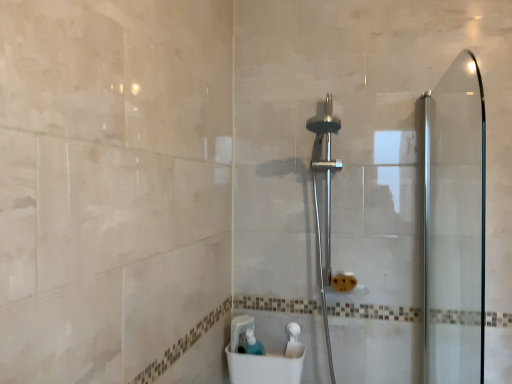
Question: Considering their positions, is polished chrome shower head at center located in front of or behind translucent plastic soap dispenser at lower center?

Choices:
 (A) behind
 (B) front

Answer: (B)

Question: Do you think polished chrome shower head at center is within translucent plastic soap dispenser at lower center, or outside of it?

Choices:
 (A) outside
 (B) inside

Answer: (A)

Question: Estimate the real-world distances between objects in this image. Which object is closer to the transparent glass screen door at right?

Choices:
 (A) white plastic sink at lower center
 (B) translucent plastic soap dispenser at lower center
 (C) polished chrome shower head at center

Answer: (C)

Question: Which object is the closest to the translucent plastic soap dispenser at lower center?

Choices:
 (A) transparent glass screen door at right
 (B) white plastic sink at lower center
 (C) polished chrome shower head at center

Answer: (B)